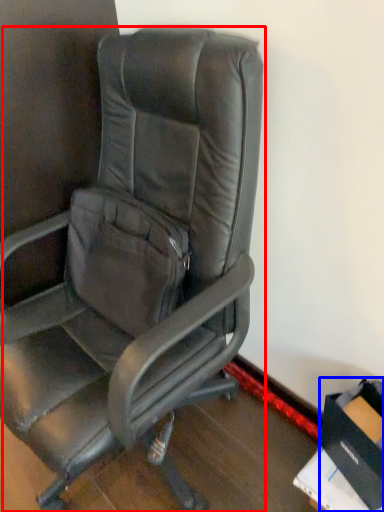
Question: Among these objects, which one is farthest to the camera, chair (highlighted by a red box) or cardboard box (highlighted by a blue box)?

Choices:
 (A) chair
 (B) cardboard box

Answer: (B)